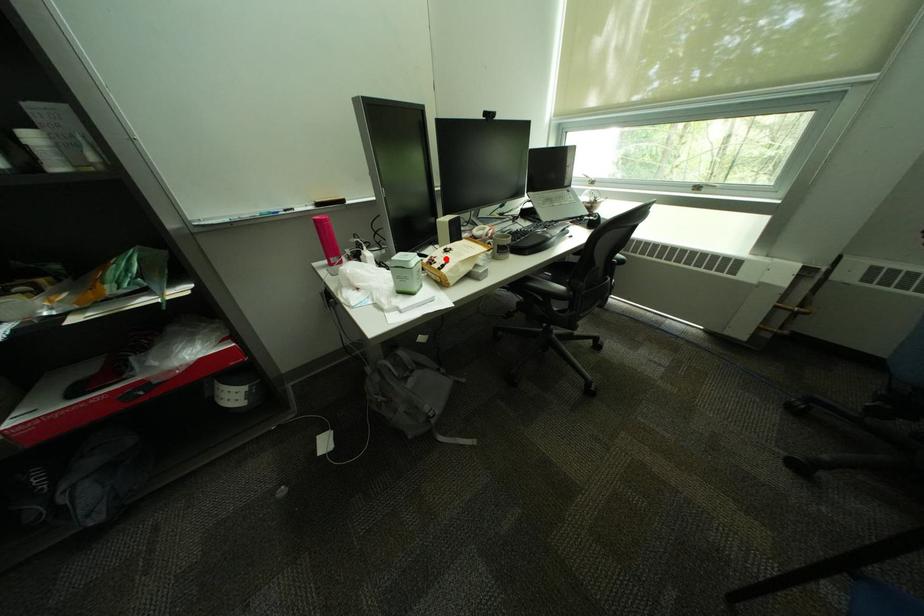
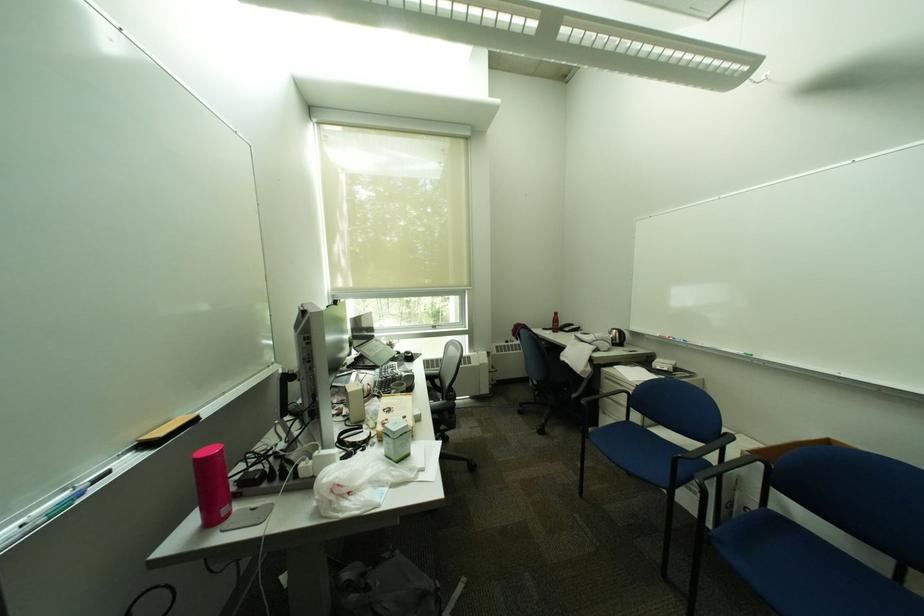
Find the pixel in the second image that matches the highlighted location in the first image.

(397, 421)